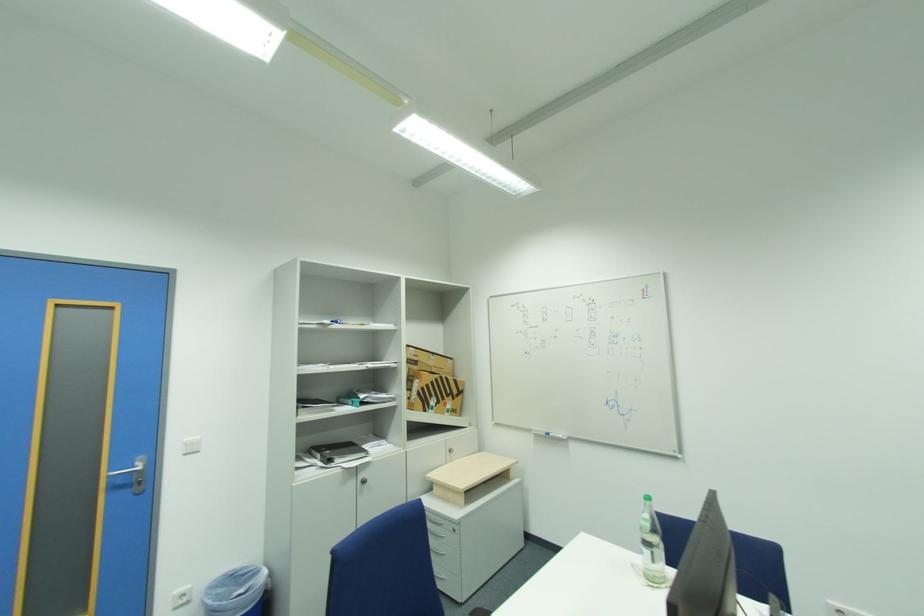
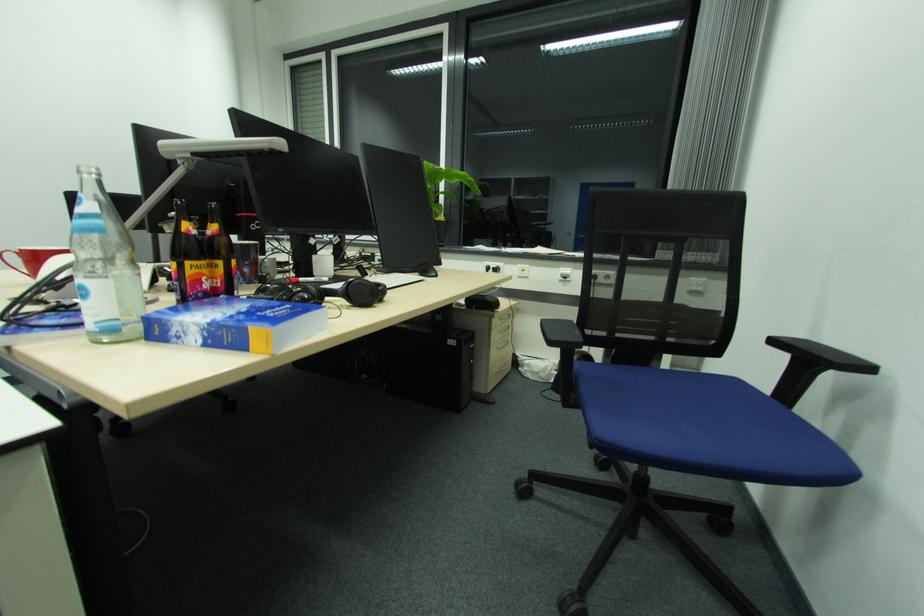
Question: The camera is either moving clockwise (left) or counter-clockwise (right) around the object. The first image is from the beginning of the video and the second image is from the end. Is the camera moving left or right when shooting the video?

Choices:
 (A) Left
 (B) Right

Answer: (A)